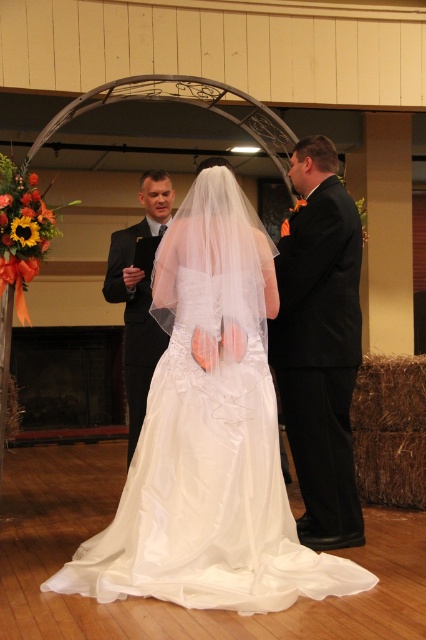
You are a photographer at the wedding ceremony. You need to position yourself so that you can capture the white satin dress at center clearly. Where should you stand relative to the point marked at coordinate (x=206, y=509)?

You should position yourself directly at the point marked at coordinate (x=206, y=509) to capture the white satin dress at center clearly, as that is where the dress is located.

You are a photographer at a wedding and you need to capture a photo of the black satin suit at right and dark gray suit at center. Which suit is located to the right of the other?

The black satin suit at right is positioned on the right side of dark gray suit at center.